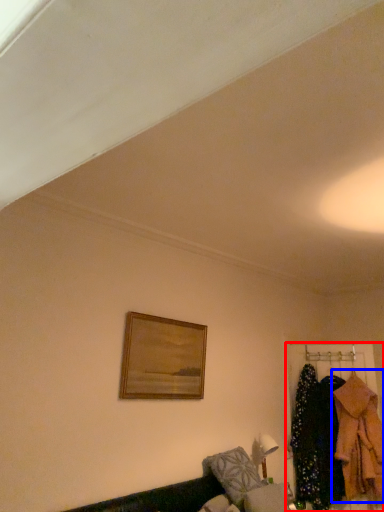
Question: Which object appears farthest to the camera in this image, closet (highlighted by a red box) or clothing (highlighted by a blue box)?

Choices:
 (A) closet
 (B) clothing

Answer: (A)